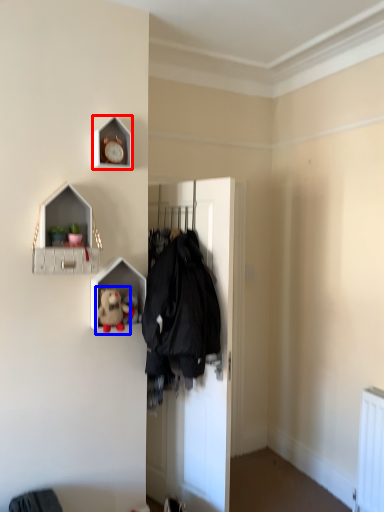
Question: Which object is further to the camera taking this photo, clock (highlighted by a red box) or toy (highlighted by a blue box)?

Choices:
 (A) clock
 (B) toy

Answer: (A)